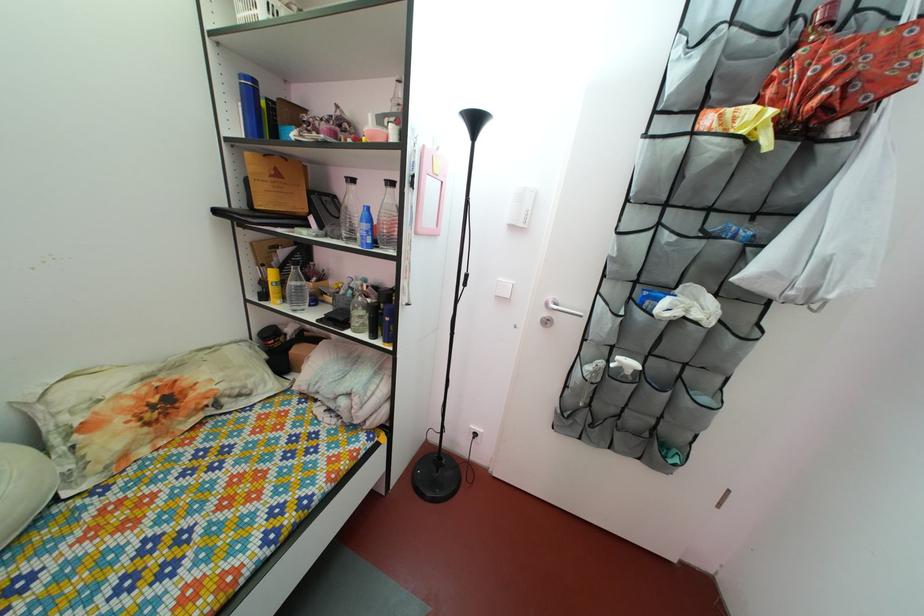
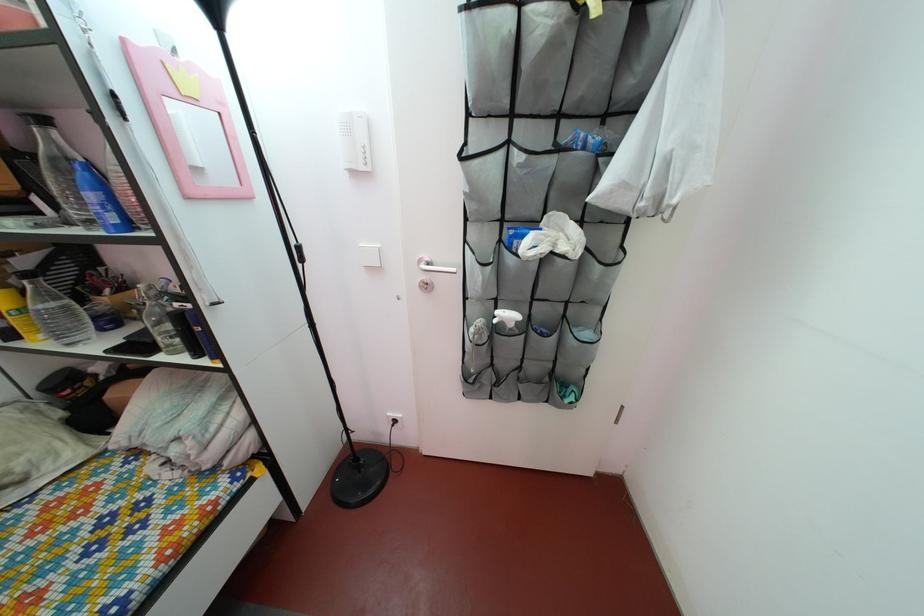
Where in the second image is the point corresponding to pixel 330 233 from the first image?

(68, 217)